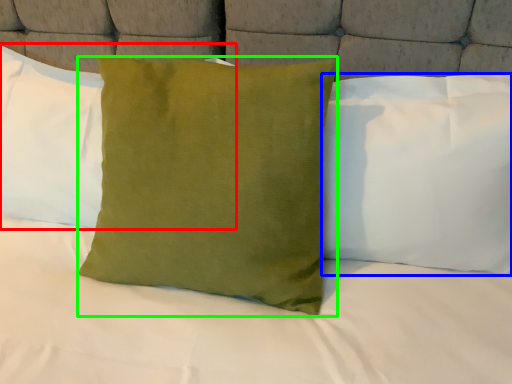
Question: Which is farther away from pillow (highlighted by a red box)? pillow (highlighted by a blue box) or pillow (highlighted by a green box)?

Choices:
 (A) pillow
 (B) pillow

Answer: (A)